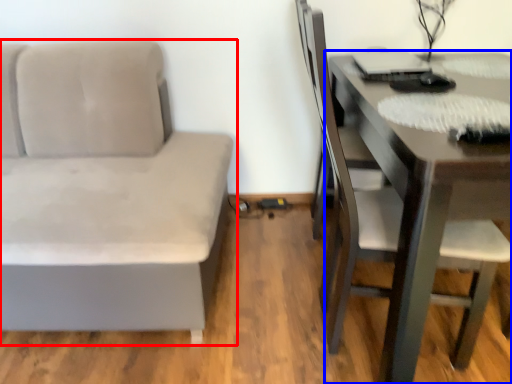
Question: Which object appears closest to the camera in this image, studio couch (highlighted by a red box) or table (highlighted by a blue box)?

Choices:
 (A) studio couch
 (B) table

Answer: (B)